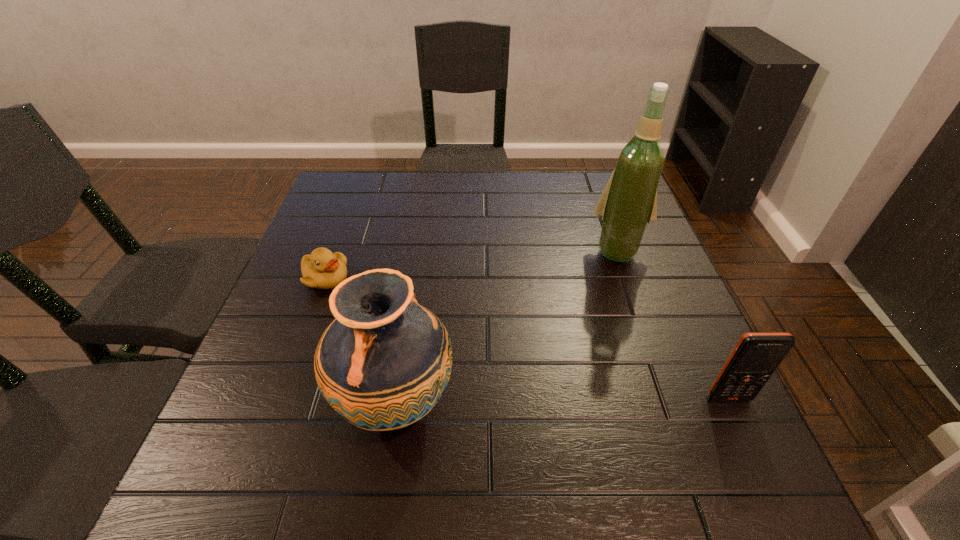
What are the coordinates of `vacant space located at the beak of the duckling` in the screenshot? It's located at (446, 348).

You are a GUI agent. You are given a task and a screenshot of the screen. Output one action in this format:
    pyautogui.click(x=<x>, y=<y>)
    Task: Click on the vacant space located at the beak of the duckling
    Image resolution: width=960 pixels, height=540 pixels.
    Given the screenshot: What is the action you would take?
    pyautogui.click(x=470, y=362)

At what (x,y) coordinates should I click in order to perform the action: click on vacant region located 0.350m at the beak of the duckling. Please return your answer as a coordinate pair (x, y). Looking at the image, I should click on (463, 357).

I want to click on pottery located at the near edge, so click(x=383, y=363).

Find the location of a particular element. cellular telephone at the near edge is located at coordinates (756, 356).

In order to click on object that is at the left edge in this screenshot , I will do `click(322, 269)`.

Where is `cellular telephone located at the right edge`? cellular telephone located at the right edge is located at coordinates (756, 356).

Where is `wine bottle at the right edge`? wine bottle at the right edge is located at coordinates (629, 201).

Locate an element on the screen. This screenshot has height=540, width=960. object located at the near right corner is located at coordinates (756, 356).

Identify the location of free location at the far edge. Image resolution: width=960 pixels, height=540 pixels. (562, 192).